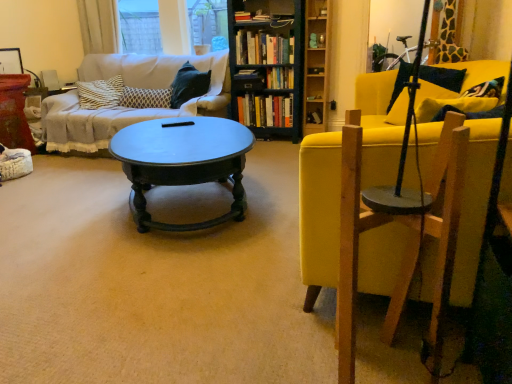
This screenshot has width=512, height=384. Identify the location of free space above hardcover book at center, arranged as the fourth book when ordered from the bottom (from a real-world perspective). (250, 70).